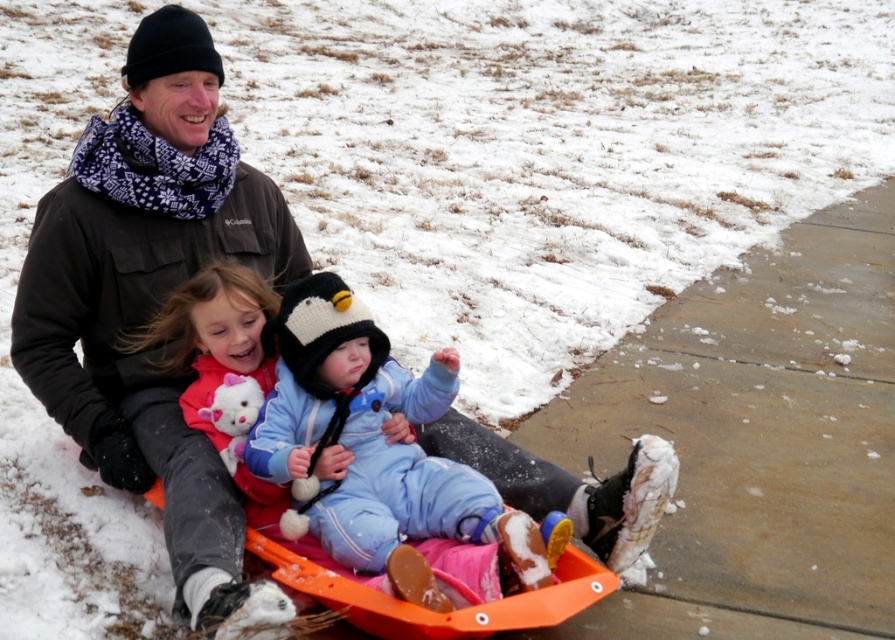
Question: Which point is farther to the camera?

Choices:
 (A) light blue fleece snowsuit at center
 (B) dark brown jacket at center

Answer: (A)

Question: Does dark brown jacket at center lie behind light blue fleece snowsuit at center?

Choices:
 (A) yes
 (B) no

Answer: (B)

Question: Can you confirm if dark brown jacket at center is positioned above light blue fleece snowsuit at center?

Choices:
 (A) no
 (B) yes

Answer: (B)

Question: Which point is closer to the camera taking this photo?

Choices:
 (A) (358, 477)
 (B) (431, 436)

Answer: (A)

Question: Is dark brown jacket at center thinner than light blue fleece snowsuit at center?

Choices:
 (A) yes
 (B) no

Answer: (B)